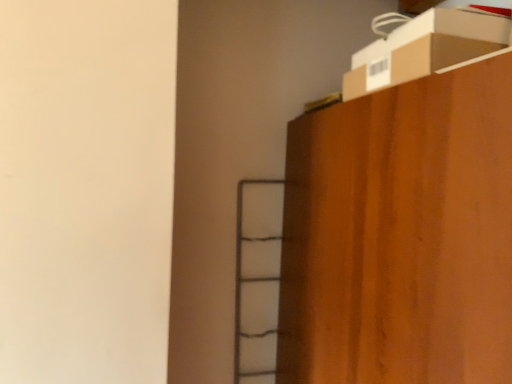
This screenshot has width=512, height=384. What do you see at coordinates (401, 235) in the screenshot?
I see `wooden cabinet at upper right` at bounding box center [401, 235].

Identify the location of wooden cabinet at upper right. point(401,235).

In order to face brown cardboard box at upper right, should I rotate leftwards or rightwards?

Rotate your view right by about 20.822°.

The height and width of the screenshot is (384, 512). I want to click on brown cardboard box at upper right, so click(424, 49).

Image resolution: width=512 pixels, height=384 pixels. What do you see at coordinates (424, 49) in the screenshot?
I see `brown cardboard box at upper right` at bounding box center [424, 49].

Locate an element on the screen. This screenshot has height=384, width=512. wooden cabinet at upper right is located at coordinates (401, 235).

Between wooden cabinet at upper right and brown cardboard box at upper right, which one appears on the right side from the viewer's perspective?

From the viewer's perspective, wooden cabinet at upper right appears more on the right side.

Considering the positions of objects wooden cabinet at upper right and brown cardboard box at upper right in the image provided, who is behind, wooden cabinet at upper right or brown cardboard box at upper right?

brown cardboard box at upper right.

Is point (346, 320) farther from camera compared to point (352, 87)?

No, (346, 320) is closer to viewer.

From the image's perspective, is wooden cabinet at upper right located beneath brown cardboard box at upper right?

Indeed, from the image's perspective, wooden cabinet at upper right is shown beneath brown cardboard box at upper right.

From a real-world perspective, is wooden cabinet at upper right positioned above or below brown cardboard box at upper right?

In terms of real-world spatial position, wooden cabinet at upper right is below brown cardboard box at upper right.

Considering the relative sizes of wooden cabinet at upper right and brown cardboard box at upper right in the image provided, is wooden cabinet at upper right wider than brown cardboard box at upper right?

Yes.

Consider the image. Considering the sizes of wooden cabinet at upper right and brown cardboard box at upper right in the image, is wooden cabinet at upper right taller or shorter than brown cardboard box at upper right?

In the image, wooden cabinet at upper right appears to be taller than brown cardboard box at upper right.

Based on the photo, considering the relative sizes of wooden cabinet at upper right and brown cardboard box at upper right in the image provided, is wooden cabinet at upper right smaller than brown cardboard box at upper right?

No.

Is wooden cabinet at upper right not inside brown cardboard box at upper right?

wooden cabinet at upper right lies outside brown cardboard box at upper right's area.

Are wooden cabinet at upper right and brown cardboard box at upper right beside each other?

No, wooden cabinet at upper right is not beside brown cardboard box at upper right.

Consider the image. Is brown cardboard box at upper right at the back of wooden cabinet at upper right?

No, wooden cabinet at upper right's orientation is not away from brown cardboard box at upper right.

Find the location of `cardboard box above the wooden cabinet at upper right (from the image's perspective)`. cardboard box above the wooden cabinet at upper right (from the image's perspective) is located at coordinates (424, 49).

In the scene shown: Is brown cardboard box at upper right at the left side of wooden cabinet at upper right?

Yes.

Does brown cardboard box at upper right come in front of wooden cabinet at upper right?

No, brown cardboard box at upper right is behind wooden cabinet at upper right.

Between point (428, 58) and point (437, 360), which one is positioned behind?

The point (428, 58) is more distant.

From the image's perspective, which is above, brown cardboard box at upper right or wooden cabinet at upper right?

brown cardboard box at upper right appears higher in the image.

From a real-world perspective, who is located lower, brown cardboard box at upper right or wooden cabinet at upper right?

wooden cabinet at upper right.

In the scene shown: Between brown cardboard box at upper right and wooden cabinet at upper right, which one has larger width?

wooden cabinet at upper right.

Which of these two, brown cardboard box at upper right or wooden cabinet at upper right, stands taller?

wooden cabinet at upper right is taller.

Who is bigger, brown cardboard box at upper right or wooden cabinet at upper right?

wooden cabinet at upper right is bigger.

Would you say brown cardboard box at upper right contains wooden cabinet at upper right?

No, wooden cabinet at upper right is located outside of brown cardboard box at upper right.

Is the surface of brown cardboard box at upper right in direct contact with wooden cabinet at upper right?

No, brown cardboard box at upper right is not with wooden cabinet at upper right.

Is brown cardboard box at upper right facing towards wooden cabinet at upper right?

No.

What's the angular difference between brown cardboard box at upper right and wooden cabinet at upper right's facing directions?

The angular difference between brown cardboard box at upper right and wooden cabinet at upper right is 0.000254 degrees.

At what (x,y) coordinates should I click in order to perform the action: click on furniture directly beneath the brown cardboard box at upper right (from a real-world perspective). Please return your answer as a coordinate pair (x, y). Looking at the image, I should click on (401, 235).

You are a GUI agent. You are given a task and a screenshot of the screen. Output one action in this format:
    pyautogui.click(x=<x>, y=<y>)
    Task: Click on the furniture beneath the brown cardboard box at upper right (from a real-world perspective)
    
    Given the screenshot: What is the action you would take?
    pyautogui.click(x=401, y=235)

Locate an element on the screen. This screenshot has width=512, height=384. cardboard box behind the wooden cabinet at upper right is located at coordinates (424, 49).